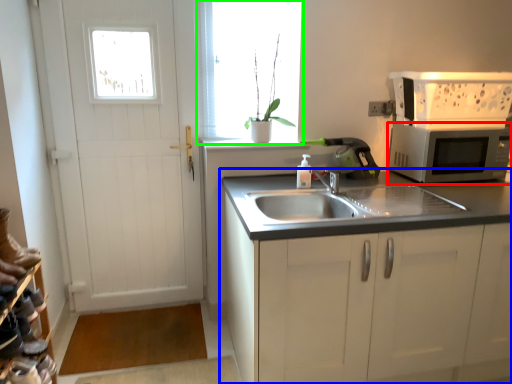
Question: Which object is the closest to the microwave oven (highlighted by a red box)? Choose among these: cabinetry (highlighted by a blue box) or window (highlighted by a green box).

Choices:
 (A) cabinetry
 (B) window

Answer: (A)